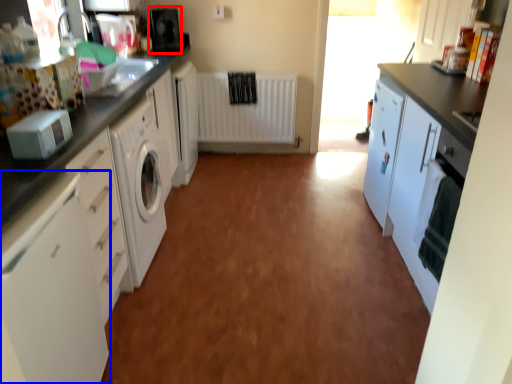
Question: Among these objects, which one is farthest to the camera, appliance (highlighted by a red box) or cabinetry (highlighted by a blue box)?

Choices:
 (A) appliance
 (B) cabinetry

Answer: (A)